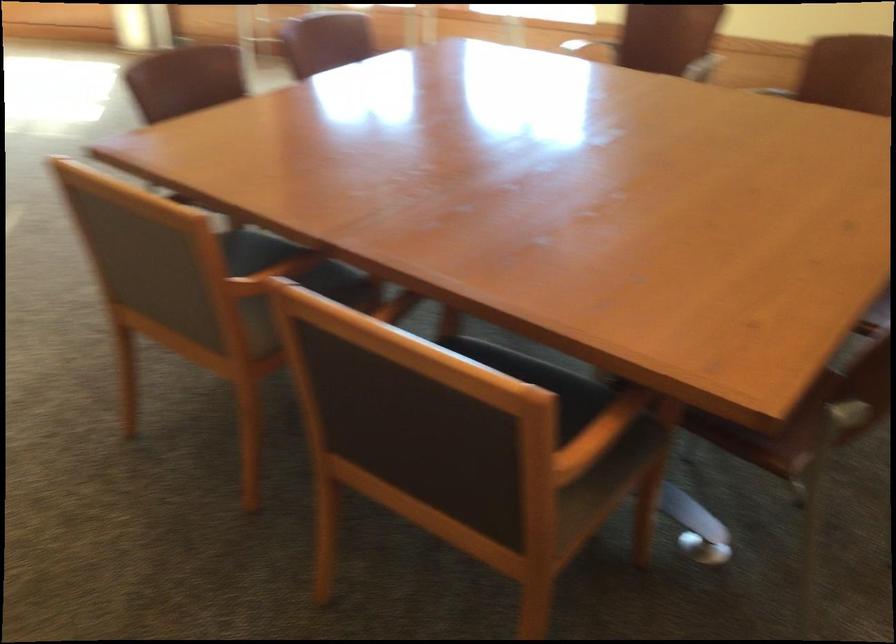
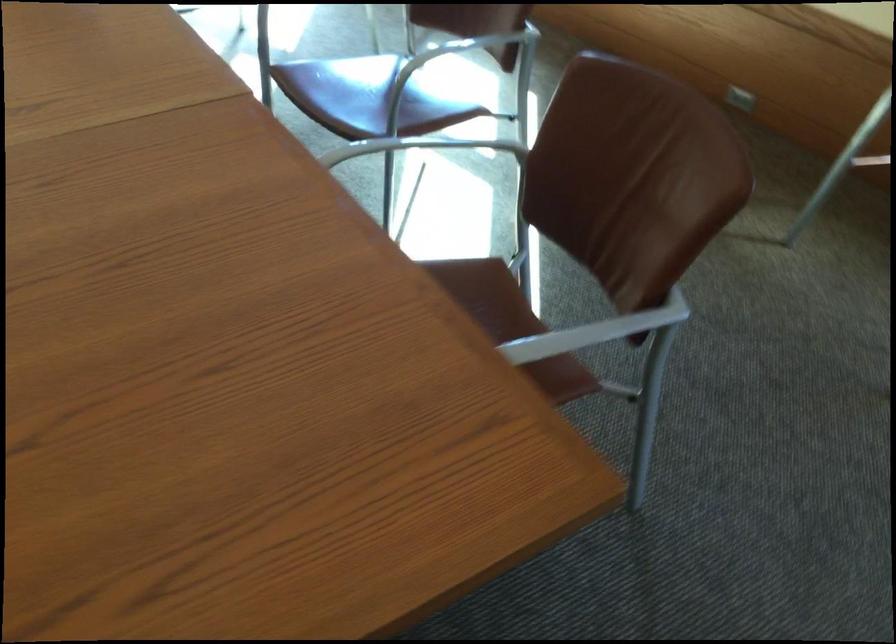
The images are taken continuously from a first-person perspective. In which direction are you moving?

The cameraman moved toward right, forward.